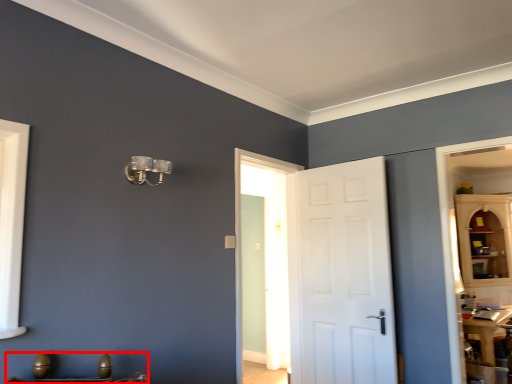
Question: Considering the relative positions of furniture (annotated by the red box) and door in the image provided, where is furniture (annotated by the red box) located with respect to the staircase?

Choices:
 (A) right
 (B) left

Answer: (B)